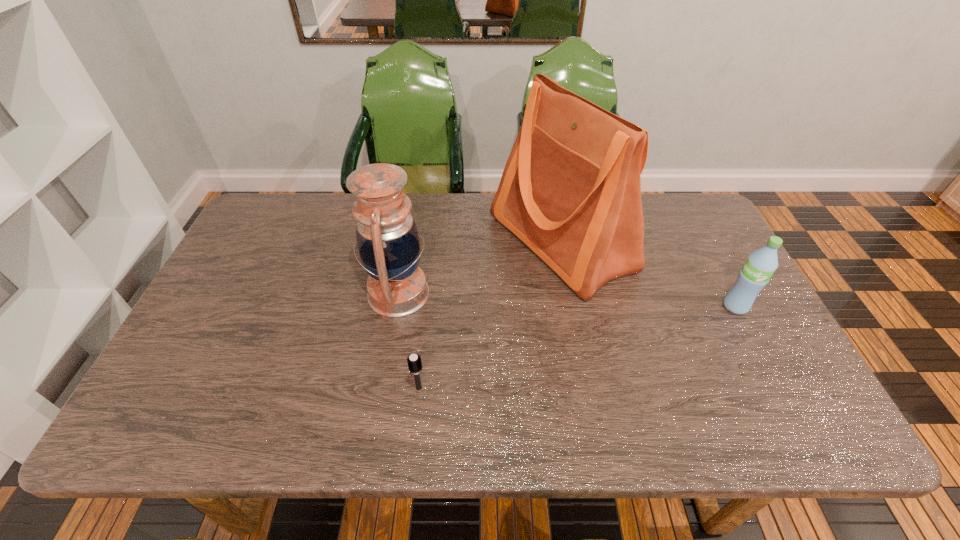
In order to click on object situated at the far edge in this screenshot , I will do `click(571, 188)`.

The image size is (960, 540). Identify the location of object positioned at the right edge. (761, 264).

This screenshot has height=540, width=960. Find the location of `vacant space at the far edge`. vacant space at the far edge is located at coordinates tap(429, 218).

This screenshot has width=960, height=540. Identify the location of vacant region at the left edge. (218, 301).

The width and height of the screenshot is (960, 540). Find the location of `free spot at the right edge of the desktop`. free spot at the right edge of the desktop is located at coordinates (689, 276).

Find the location of a particular element. vacant area at the far left corner of the desktop is located at coordinates (304, 213).

This screenshot has height=540, width=960. I want to click on vacant space at the near left corner of the desktop, so click(x=152, y=430).

This screenshot has width=960, height=540. I want to click on vacant space at the far right corner, so click(x=702, y=206).

Locate an element on the screen. This screenshot has width=960, height=540. empty space between the hairbrush and the third shortest object is located at coordinates (409, 341).

Image resolution: width=960 pixels, height=540 pixels. Identify the location of free spot between the second tallest object and the nearest object. (409, 341).